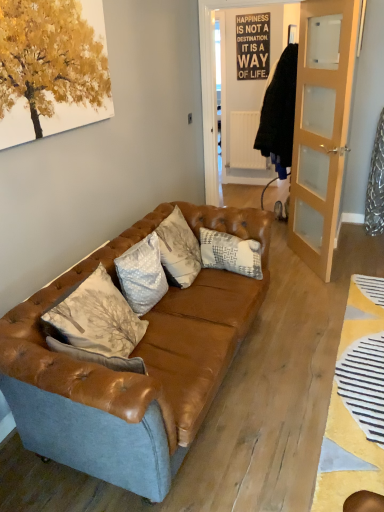
Question: Is light brown wooden door at right bigger than white textured pillow at center, positioned as the first pillow in front-to-back order?

Choices:
 (A) yes
 (B) no

Answer: (A)

Question: Is light brown wooden door at right wider than white textured pillow at center, positioned as the first pillow in front-to-back order?

Choices:
 (A) no
 (B) yes

Answer: (A)

Question: Does light brown wooden door at right have a lesser height compared to white textured pillow at center, which is the 2th pillow from back to front?

Choices:
 (A) no
 (B) yes

Answer: (A)

Question: Can you confirm if light brown wooden door at right is smaller than white textured pillow at center, which is the 2th pillow in right-to-left order?

Choices:
 (A) no
 (B) yes

Answer: (A)

Question: From a real-world perspective, is light brown wooden door at right physically below white textured pillow at center, which is the 2th pillow from back to front?

Choices:
 (A) yes
 (B) no

Answer: (B)

Question: Is light brown wooden door at right outside white textured pillow at center, positioned as the first pillow in front-to-back order?

Choices:
 (A) yes
 (B) no

Answer: (A)

Question: Does white textured pillow at center, marked as the 1th pillow in a right-to-left arrangement, come in front of white textured pillow at center, which is the 2th pillow from back to front?

Choices:
 (A) no
 (B) yes

Answer: (A)

Question: Does white textured pillow at center, the 2th pillow in the front-to-back sequence, contain white textured pillow at center, which ranks as the 1th pillow in left-to-right order?

Choices:
 (A) no
 (B) yes

Answer: (A)

Question: From a real-world perspective, does white textured pillow at center, the 2th pillow in the front-to-back sequence, stand above white textured pillow at center, which ranks as the 1th pillow in left-to-right order?

Choices:
 (A) no
 (B) yes

Answer: (A)

Question: Does white textured pillow at center, placed as the second pillow when sorted from left to right, have a lesser width compared to white textured pillow at center, positioned as the first pillow in front-to-back order?

Choices:
 (A) yes
 (B) no

Answer: (A)

Question: Is white textured pillow at center, marked as the 1th pillow in a right-to-left arrangement, far from white textured pillow at center, which ranks as the 1th pillow in left-to-right order?

Choices:
 (A) no
 (B) yes

Answer: (A)

Question: Is white textured pillow at center, the 2th pillow in the front-to-back sequence, with white textured pillow at center, which is the 2th pillow in right-to-left order?

Choices:
 (A) no
 (B) yes

Answer: (A)

Question: Is leather couch at center completely or partially inside light brown wooden door at right?

Choices:
 (A) no
 (B) yes

Answer: (A)